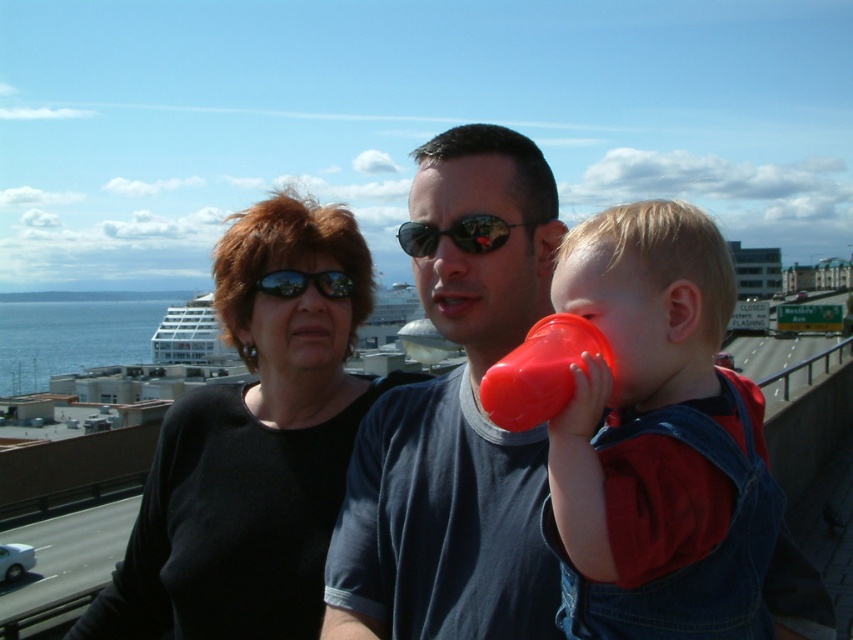
Question: Observing the image, what is the correct spatial positioning of matte black shirt at center in reference to black matte shirt at center?

Choices:
 (A) right
 (B) left

Answer: (A)

Question: Estimate the real-world distances between objects in this image. Which object is closer to the matte black shirt at center?

Choices:
 (A) black matte shirt at center
 (B) sunglasses at center

Answer: (B)

Question: Which of the following is the closest to the observer?

Choices:
 (A) black reflective sunglasses at center
 (B) sunglasses at center
 (C) rubberized plastic cup at right
 (D) black matte shirt at center

Answer: (C)

Question: Observing the image, what is the correct spatial positioning of black matte shirt at center in reference to rubberized plastic cup at right?

Choices:
 (A) above
 (B) below

Answer: (B)

Question: Which point appears farthest from the camera in this image?

Choices:
 (A) (498, 240)
 (B) (434, 512)
 (C) (323, 291)
 (D) (699, 602)

Answer: (C)

Question: Does black matte shirt at center have a greater width compared to sunglasses at center?

Choices:
 (A) no
 (B) yes

Answer: (B)